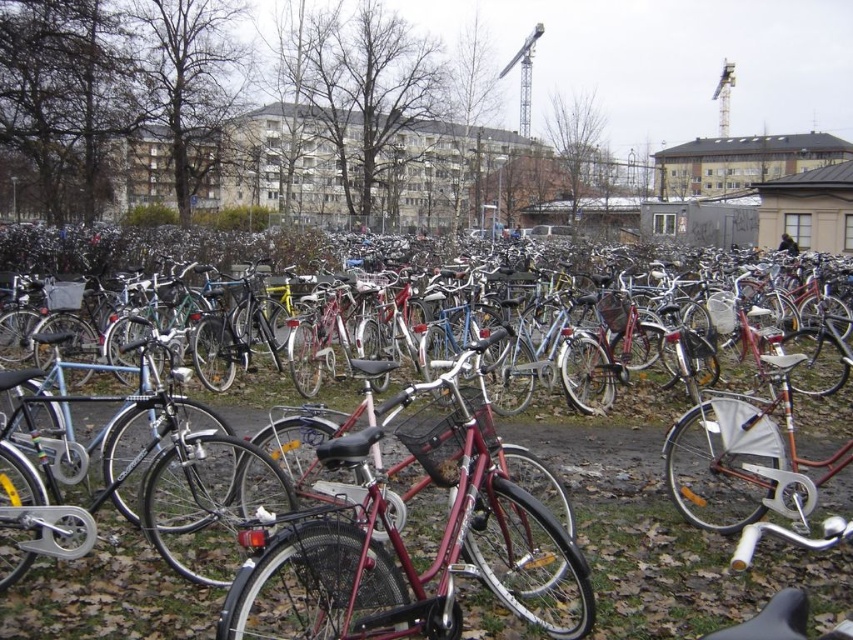
You are standing in the outdoor area and see the metallic bicycles at center and the shiny red bicycle at center. Which one is positioned to the right of the other?

The metallic bicycles at center are positioned to the right of the shiny red bicycle at center.

You are standing at the point with coordinates 0.5, 0.5 in this scene. If you want to walk towards the shiny black bicycle at center, in which direction should you move? Please provide your answer in terms of compass directions like north, south, east, west, northeast, etc.

Since the shiny black bicycle at center is located at point (154, 470) and you are at (426, 320), you should move southeast to reach it.

You are a delivery person trying to navigate through the bicycles to reach the shiny black bicycle at center. Which direction should you move relative to the metallic bicycles at center to get to it?

The metallic bicycles at center is positioned on the right side of the shiny black bicycle at center, so you should move to the left of the metallic bicycles at center to reach the shiny black bicycle at center.